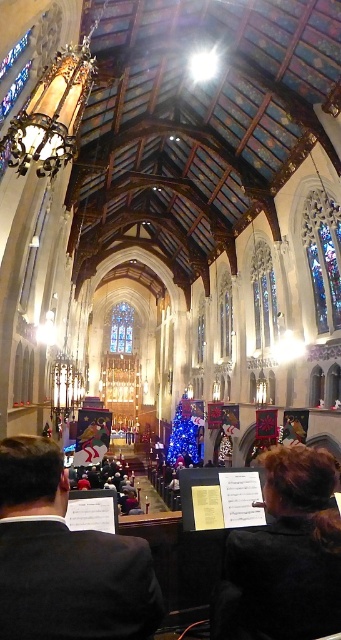
Which is below, dark suit at center or stained glass window at upper center?

dark suit at center is below.

Who is higher up, dark suit at center or stained glass window at upper center?

stained glass window at upper center is above.

Locate an element on the screen. The image size is (341, 640). dark suit at center is located at coordinates (65, 557).

Who is positioned more to the left, dark suit at center or stained glass window at center?

Positioned to the left is stained glass window at center.

Is dark suit at center behind stained glass window at center?

That is False.

Is point (7, 592) in front of point (132, 310)?

Yes, point (7, 592) is in front of point (132, 310).

The image size is (341, 640). I want to click on dark suit at center, so point(65,557).

Is point (305, 198) behind point (120, 310)?

No, (305, 198) is closer to viewer.

In the scene shown: Does stained glass window at upper right have a larger size compared to stained glass window at center?

No, stained glass window at upper right is not bigger than stained glass window at center.

Describe the element at coordinates (322, 257) in the screenshot. Image resolution: width=341 pixels, height=640 pixels. I see `stained glass window at upper right` at that location.

The image size is (341, 640). I want to click on stained glass window at upper right, so click(x=322, y=257).